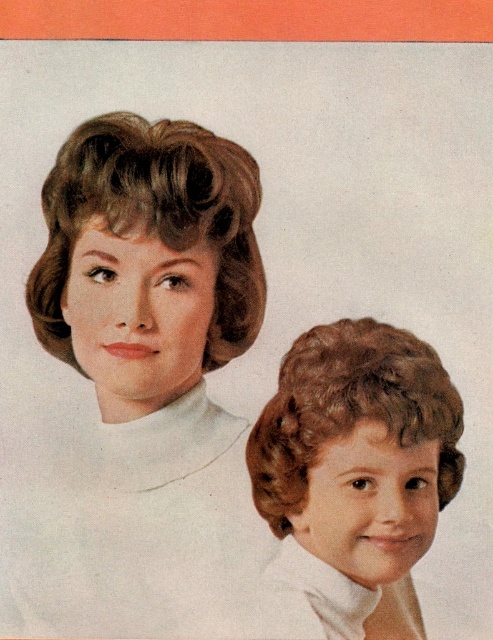
Is point (139, 132) farther from viewer compared to point (411, 524)?

Yes, it is behind point (411, 524).

Which of these two, matte brown hair at upper left or shiny brown hair at lower right, stands shorter?

shiny brown hair at lower right is shorter.

Between point (199, 348) and point (265, 472), which one is positioned in front?

Point (265, 472)

Locate an element on the screen. The height and width of the screenshot is (640, 493). matte brown hair at upper left is located at coordinates (143, 378).